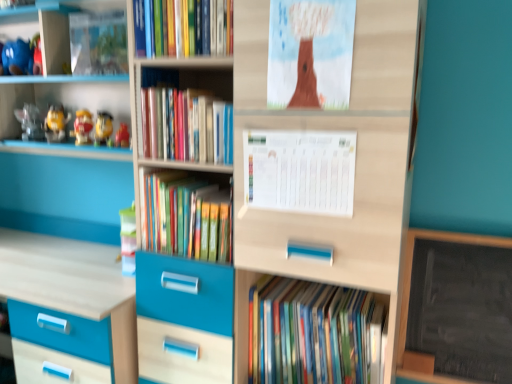
Question: Based on their sizes in the image, would you say hardcover books at center, the third book viewed from the top, is bigger or smaller than matte yellow toy at left, the 1th toy from the right?

Choices:
 (A) small
 (B) big

Answer: (B)

Question: Is hardcover books at center, marked as the 2th book in a bottom-to-top arrangement, spatially inside matte yellow toy at left, the 1th toy from the right, or outside of it?

Choices:
 (A) inside
 (B) outside

Answer: (B)

Question: Considering the real-world distances, which object is farthest from the white paper calendar at center, the 1th paperback book in the bottom-to-top sequence?

Choices:
 (A) yellow matte minion at left, arranged as the 2th toy when viewed from the left
 (B) brown paper at upper center, arranged as the 1th paperback book when viewed from the top
 (C) hardcover books at upper center, the first book when ordered from top to bottom
 (D) matte yellow toy at upper left, which is the 3th toy from left to right
 (E) hardcover books at center, which ranks as the 1th book in bottom-to-top order

Answer: (A)

Question: Estimate the real-world distances between objects in this image. Which object is farther from the hardcover books at center, which appears as the 3th book when ordered from the bottom?

Choices:
 (A) hardcover books at upper center, acting as the 4th book starting from the bottom
 (B) hardcover books at center, marked as the 2th book in a bottom-to-top arrangement
 (C) yellow matte minion at left, arranged as the 2th toy when viewed from the left
 (D) hardcover books at center, positioned as the 4th book in top-to-bottom order
 (E) matte yellow toy at left, positioned as the fourth toy in left-to-right order

Answer: (C)